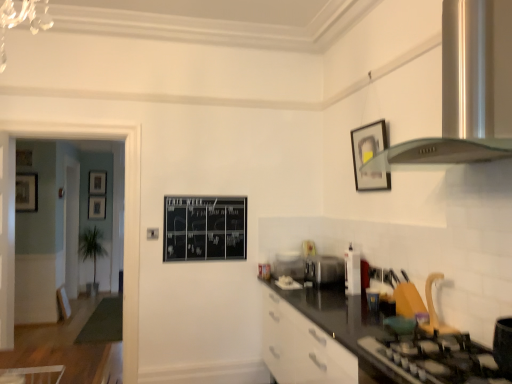
Question: From a real-world perspective, is wooden picture frame at left, positioned as the 5th picture frame in right-to-left order, beneath wooden picture frame at left, placed as the 2th picture frame when sorted from front to back?

Choices:
 (A) no
 (B) yes

Answer: (A)

Question: Is wooden picture frame at left, acting as the third picture frame starting from the back, placed right next to wooden picture frame at left, marked as the fourth picture frame in a right-to-left arrangement?

Choices:
 (A) yes
 (B) no

Answer: (B)

Question: Is wooden picture frame at left, which is counted as the 3th picture frame, starting from the front, bigger than wooden picture frame at left, the 4th picture frame positioned from the back?

Choices:
 (A) yes
 (B) no

Answer: (B)

Question: Is wooden picture frame at left, positioned as the 5th picture frame in right-to-left order, aimed at wooden picture frame at left, the 4th picture frame positioned from the back?

Choices:
 (A) no
 (B) yes

Answer: (A)

Question: Can you confirm if wooden picture frame at left, acting as the third picture frame starting from the back, is positioned to the right of wooden picture frame at left, the 4th picture frame positioned from the back?

Choices:
 (A) no
 (B) yes

Answer: (A)

Question: Are wooden picture frame at left, which is counted as the 3th picture frame, starting from the front, and wooden picture frame at left, which is the 2th picture frame in left-to-right order, located far from each other?

Choices:
 (A) yes
 (B) no

Answer: (B)

Question: Is matte black picture frame at upper right, marked as the 5th picture frame in a left-to-right arrangement, positioned with its back to black chalkboard at center?

Choices:
 (A) yes
 (B) no

Answer: (B)

Question: From the image's perspective, does matte black picture frame at upper right, the 1th picture frame when ordered from right to left, appear lower than black chalkboard at center?

Choices:
 (A) no
 (B) yes

Answer: (A)

Question: Is matte black picture frame at upper right, the 1th picture frame when ordered from right to left, positioned before black chalkboard at center?

Choices:
 (A) yes
 (B) no

Answer: (A)

Question: Is matte black picture frame at upper right, which ranks as the fifth picture frame in back-to-front order, surrounding black chalkboard at center?

Choices:
 (A) yes
 (B) no

Answer: (B)

Question: Is matte black picture frame at upper right, the 1th picture frame when ordered from right to left, next to black chalkboard at center and touching it?

Choices:
 (A) yes
 (B) no

Answer: (B)

Question: Can you confirm if matte black picture frame at upper right, the 1th picture frame when ordered from right to left, is bigger than black chalkboard at center?

Choices:
 (A) yes
 (B) no

Answer: (B)

Question: Does wooden picture frame at left, arranged as the first picture frame when viewed from the left, contain satin silver exhaust hood at upper right?

Choices:
 (A) yes
 (B) no

Answer: (B)